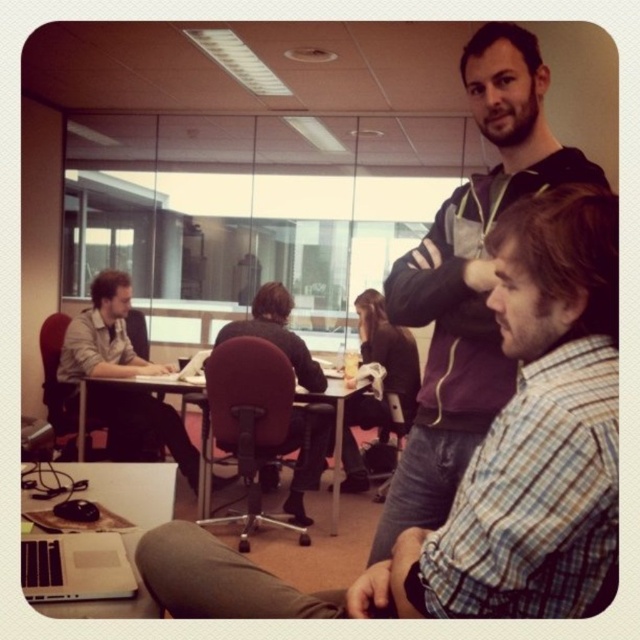
You are a visitor in the office and need to locate the plaid shirt at center and the silver metallic laptop at lower left. Based on their positions, which object is closer to the entrance of the room?

The plaid shirt at center is to the right of the silver metallic laptop at lower left, so the silver metallic laptop at lower left is closer to the entrance of the room since it is positioned further to the left compared to the plaid shirt at center.